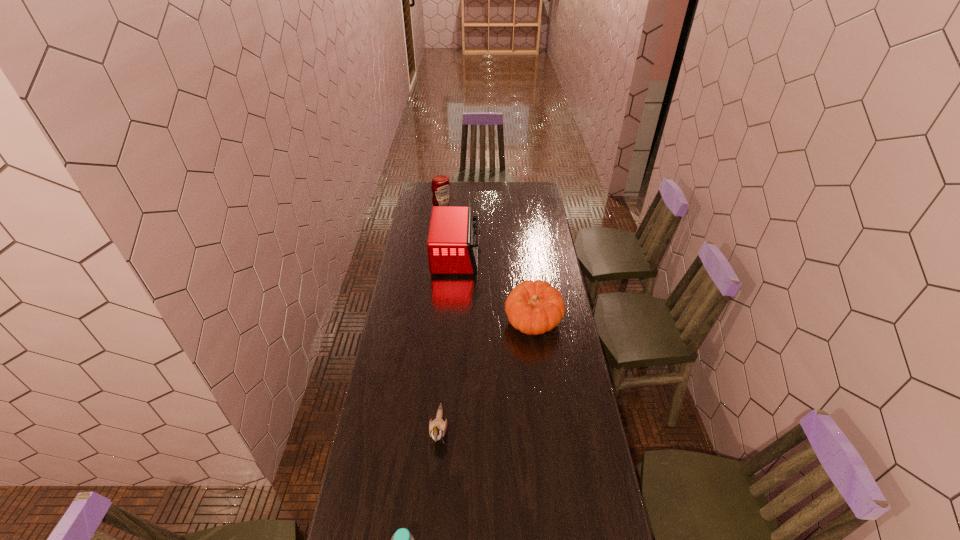
Where is `condiment`? The width and height of the screenshot is (960, 540). condiment is located at coordinates (440, 186).

Locate an element on the screen. The width and height of the screenshot is (960, 540). toaster oven is located at coordinates (452, 245).

The width and height of the screenshot is (960, 540). I want to click on pumpkin, so click(536, 307).

I want to click on the third nearest object, so click(536, 307).

You are a GUI agent. You are given a task and a screenshot of the screen. Output one action in this format:
    pyautogui.click(x=<x>, y=<y>)
    Task: Click on the bird
    
    Given the screenshot: What is the action you would take?
    (x=437, y=428)

Locate an element on the screen. Image resolution: width=960 pixels, height=540 pixels. free space located on the front of the farthest object is located at coordinates (437, 255).

Locate an element on the screen. This screenshot has height=540, width=960. vacant space located on the front-facing side of the second farthest object is located at coordinates (554, 256).

I want to click on vacant region located on the left of the pumpkin, so click(493, 322).

Locate an element on the screen. free space located at the face of the bird is located at coordinates (434, 505).

Locate an element on the screen. condiment that is at the left edge is located at coordinates (440, 186).